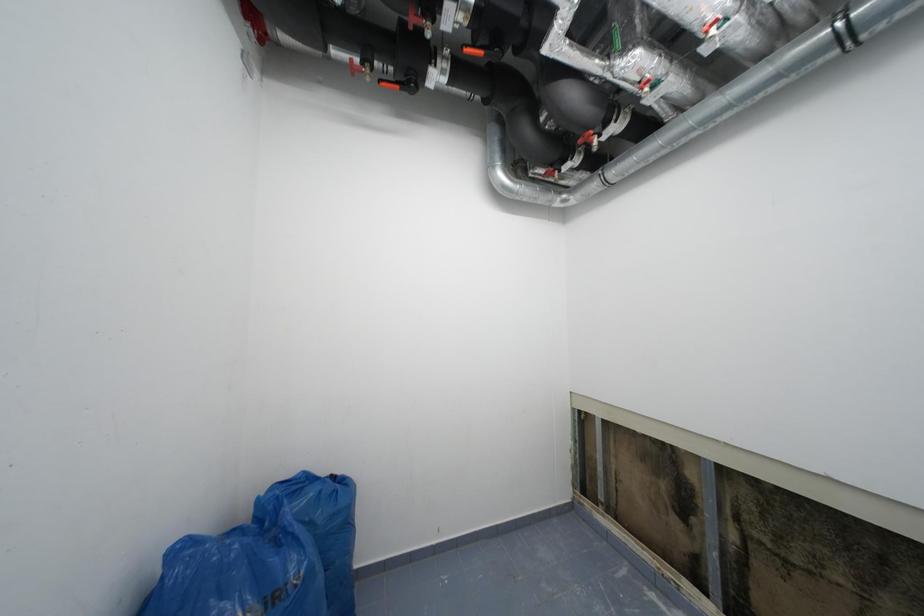
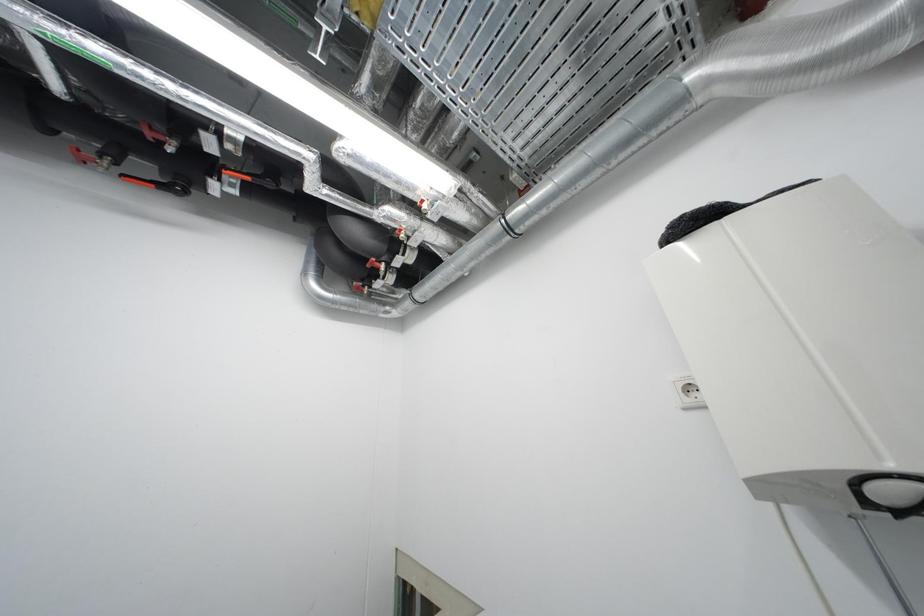
The images are taken continuously from a first-person perspective. In which direction is your viewpoint rotating?

The camera rotated toward right-up.